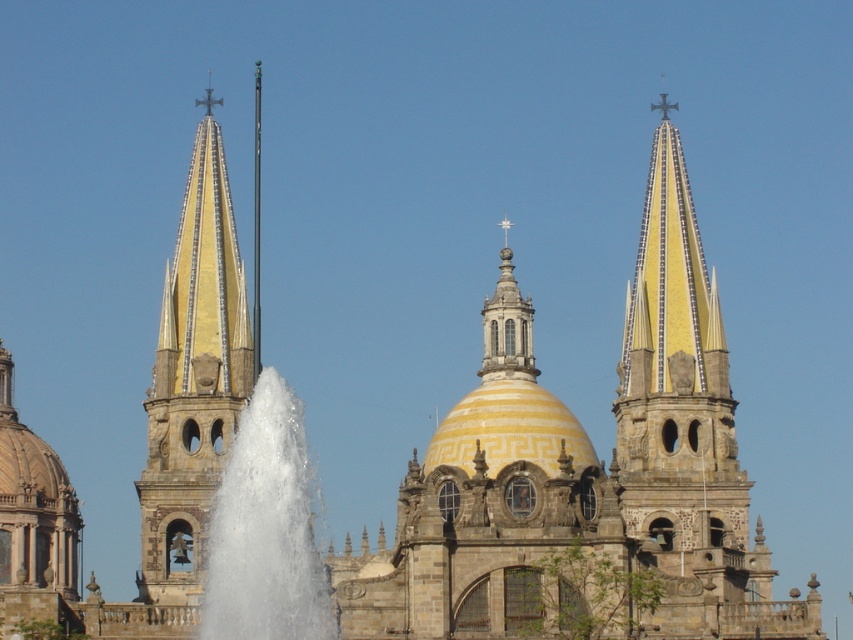
You are standing in front of the cathedral and want to take a photo of both the gold mosaic steeple at center and the white frothy water at center. Based on their positions, which object should you position to the right side of your camera frame?

The white frothy water at center should be positioned to the right side of your camera frame because the gold mosaic steeple at center is to the left of it.

You are standing in front of the cathedral and want to take a photo of the yellow stone spire at upper right. According to the coordinates provided, where exactly should you aim your camera to capture the spire in the frame?

The yellow stone spire at upper right is located at coordinates point (675, 378), so aim your camera at that specific point to capture it in the frame.